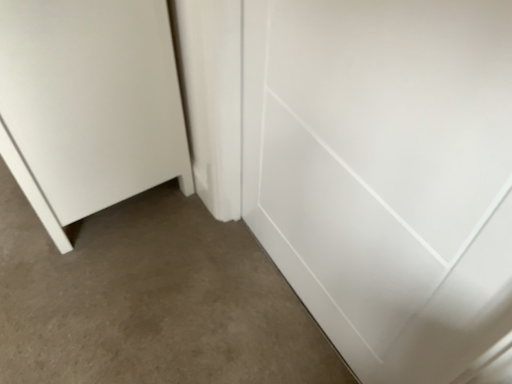
Question: Should I look upward or downward to see white matte door at lower left, which is the second door from right to left?

Choices:
 (A) up
 (B) down

Answer: (A)

Question: Is white glossy door at center, acting as the 2th door starting from the left, to the left of white matte door at lower left, which is counted as the 1th door, starting from the left, from the viewer's perspective?

Choices:
 (A) no
 (B) yes

Answer: (A)

Question: Is white glossy door at center, which is the 1th door in right-to-left order, beside white matte door at lower left, which is the second door from right to left?

Choices:
 (A) no
 (B) yes

Answer: (A)

Question: From the image's perspective, is white glossy door at center, which is the 1th door in right-to-left order, over white matte door at lower left, which is the second door from right to left?

Choices:
 (A) yes
 (B) no

Answer: (B)

Question: Is white glossy door at center, acting as the 2th door starting from the left, oriented away from white matte door at lower left, which is counted as the 1th door, starting from the left?

Choices:
 (A) yes
 (B) no

Answer: (B)

Question: From a real-world perspective, does white glossy door at center, which is the 1th door in right-to-left order, sit lower than white matte door at lower left, which is counted as the 1th door, starting from the left?

Choices:
 (A) yes
 (B) no

Answer: (B)

Question: Can you confirm if white glossy door at center, acting as the 2th door starting from the left, is shorter than white matte door at lower left, which is the second door from right to left?

Choices:
 (A) no
 (B) yes

Answer: (A)

Question: Can you confirm if white matte door at lower left, which is the second door from right to left, is shorter than white glossy door at center, which is the 1th door in right-to-left order?

Choices:
 (A) no
 (B) yes

Answer: (B)

Question: Does white matte door at lower left, which is the second door from right to left, appear on the left side of white glossy door at center, which is the 1th door in right-to-left order?

Choices:
 (A) yes
 (B) no

Answer: (A)

Question: From a real-world perspective, is white matte door at lower left, which is the second door from right to left, under white glossy door at center, acting as the 2th door starting from the left?

Choices:
 (A) yes
 (B) no

Answer: (A)

Question: From a real-world perspective, does white matte door at lower left, which is counted as the 1th door, starting from the left, stand above white glossy door at center, which is the 1th door in right-to-left order?

Choices:
 (A) yes
 (B) no

Answer: (B)

Question: Is white matte door at lower left, which is counted as the 1th door, starting from the left, positioned before white glossy door at center, which is the 1th door in right-to-left order?

Choices:
 (A) yes
 (B) no

Answer: (B)

Question: From the image's perspective, is white matte door at lower left, which is counted as the 1th door, starting from the left, on white glossy door at center, which is the 1th door in right-to-left order?

Choices:
 (A) yes
 (B) no

Answer: (A)

Question: Considering the positions of point (65, 182) and point (289, 203), is point (65, 182) closer or farther from the camera than point (289, 203)?

Choices:
 (A) closer
 (B) farther

Answer: (B)